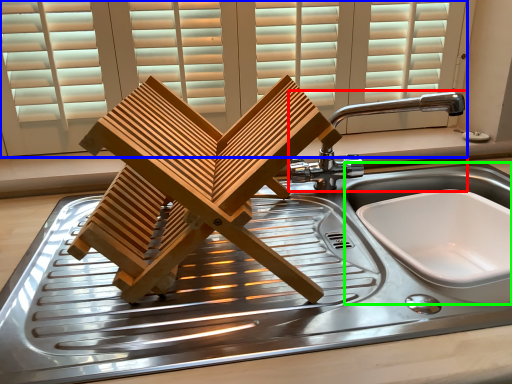
Question: Considering the real-world distances, which object is farthest from tap (highlighted by a red box)? window (highlighted by a blue box) or sink (highlighted by a green box)?

Choices:
 (A) window
 (B) sink

Answer: (A)